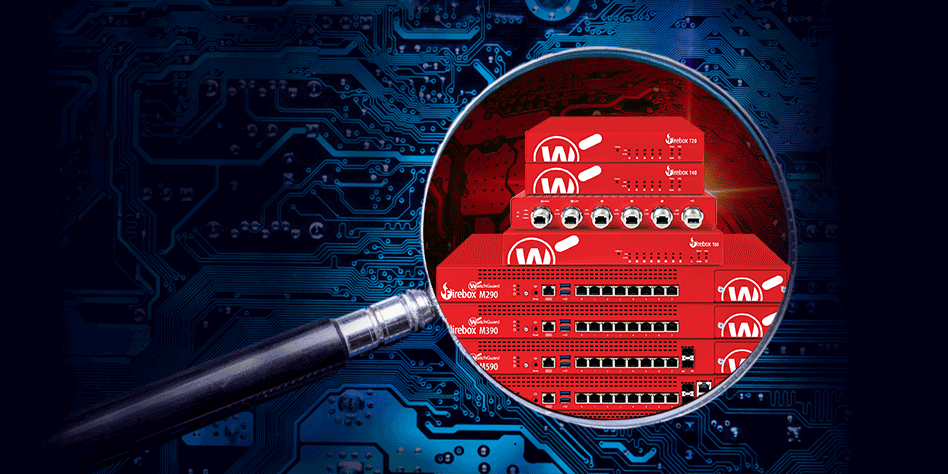
This screenshot has width=948, height=474. I want to click on access panel, so click(x=748, y=287), click(x=741, y=326), click(x=732, y=360), click(x=718, y=381).